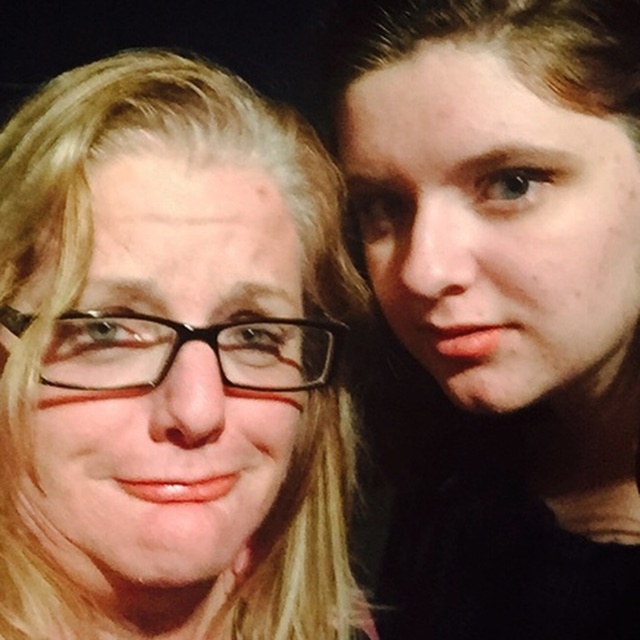
In the scene shown: Does smooth skin face at right have a smaller size compared to black plastic glasses at left?

No.

Does point (534, 588) come farther from viewer compared to point (310, 336)?

Yes.

Between point (486, 360) and point (262, 364), which one is positioned behind?

The point (486, 360) is behind.

Locate an element on the screen. This screenshot has width=640, height=640. smooth skin face at right is located at coordinates (509, 300).